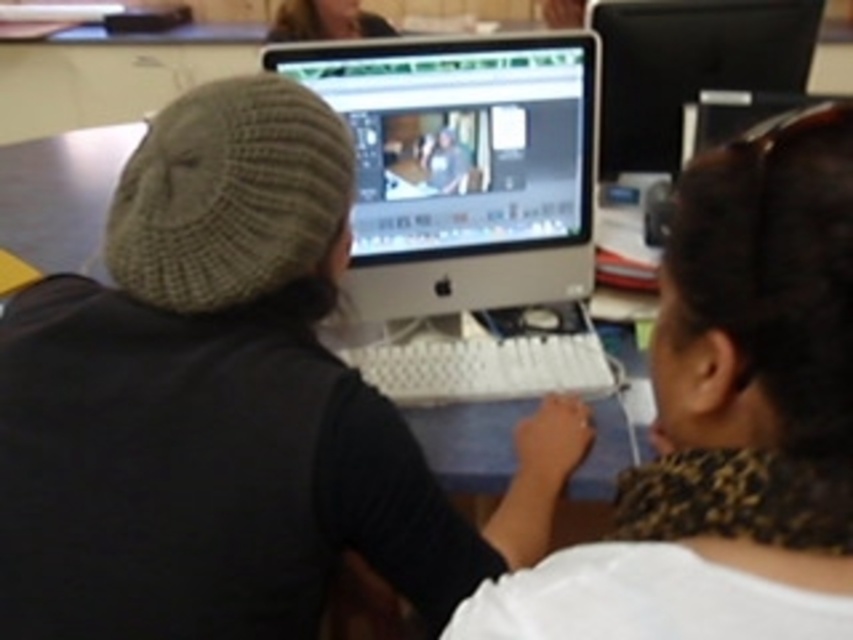
Which is in front, point (738, 60) or point (440, 433)?

Point (440, 433) is in front.

Does black glossy monitor at upper right have a lesser width compared to blue laminate table at center?

Indeed, black glossy monitor at upper right has a lesser width compared to blue laminate table at center.

Who is more forward, (x=651, y=48) or (x=492, y=452)?

Point (x=492, y=452)

In order to click on black glossy monitor at upper right in this screenshot , I will do `click(688, 65)`.

Is black glossy monitor at upper right wider than smooth skin face at upper center?

Correct, the width of black glossy monitor at upper right exceeds that of smooth skin face at upper center.

Is black glossy monitor at upper right taller than smooth skin face at upper center?

Yes, black glossy monitor at upper right is taller than smooth skin face at upper center.

Locate an element on the screen. This screenshot has height=640, width=853. black glossy monitor at upper right is located at coordinates (688, 65).

Does point (498, 108) come in front of point (270, 35)?

Yes, point (498, 108) is in front of point (270, 35).

Describe the element at coordinates (463, 166) in the screenshot. I see `satin white monitor at center` at that location.

The image size is (853, 640). I want to click on satin white monitor at center, so click(x=463, y=166).